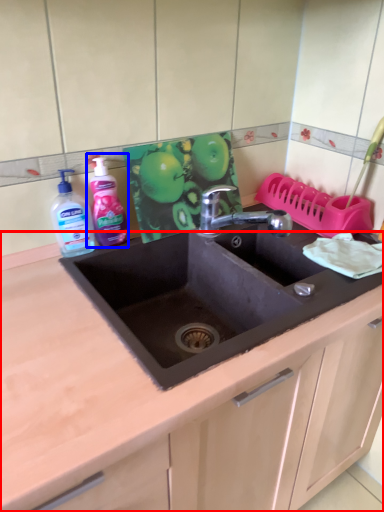
Question: Which of the following is the closest to the observer, countertop (highlighted by a red box) or cleaning product (highlighted by a blue box)?

Choices:
 (A) countertop
 (B) cleaning product

Answer: (A)